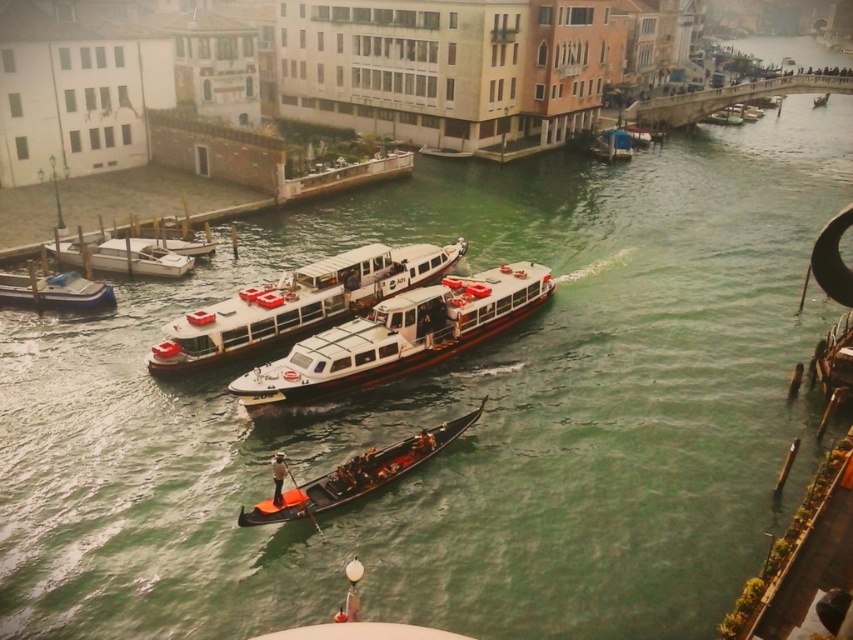
You are standing at the point with coordinates (299, 301) in the Venice canal scene. What object is exactly at your current position?

The white glossy boat at center is located at point (299, 301).

You are standing on the dock and see the white glossy boat at left. Where is it located in the image?

The white glossy boat at left is located at point 2D coordinates of [123,256].

You are a tour guide on the white glossy boat at center. You see a gondola in the foreground and two large passenger ferries in the middle ground. Which vessel is closest to your boat?

The gondola in the foreground is closest to the white glossy boat at center because it is positioned closer than the two large passenger ferries in the middle ground.